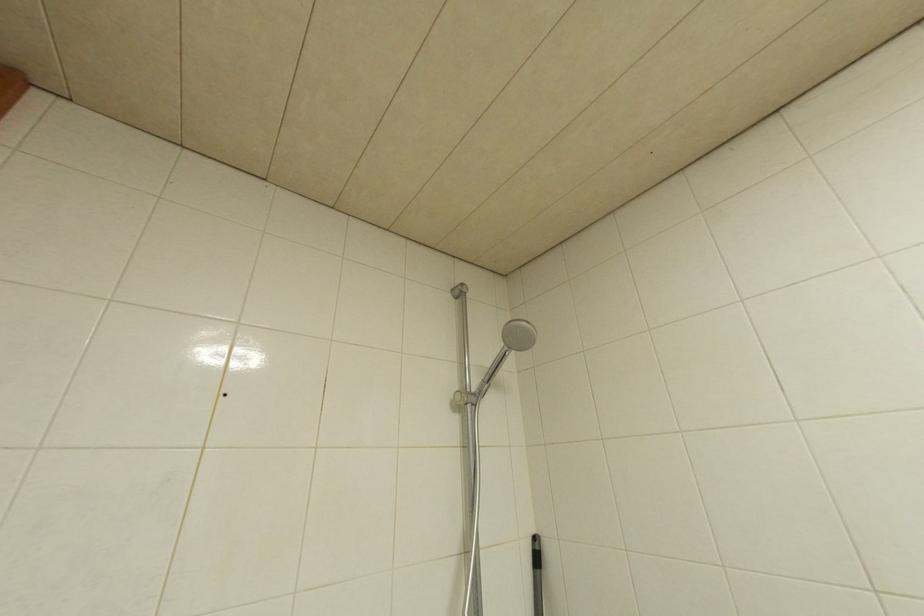
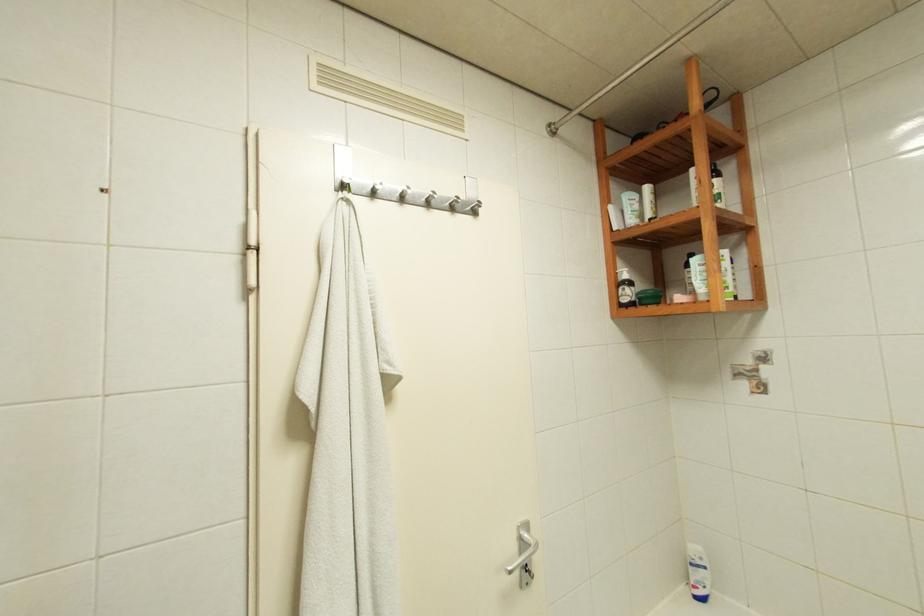
Question: The camera is either moving clockwise (left) or counter-clockwise (right) around the object. The first image is from the beginning of the video and the second image is from the end. Is the camera moving left or right when shooting the video?

Choices:
 (A) Left
 (B) Right

Answer: (A)